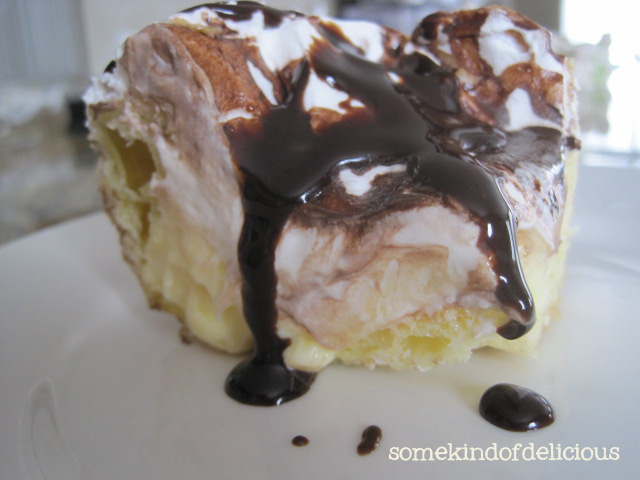
Image resolution: width=640 pixels, height=480 pixels. What are the coordinates of `window` in the screenshot? It's located at (614, 117).